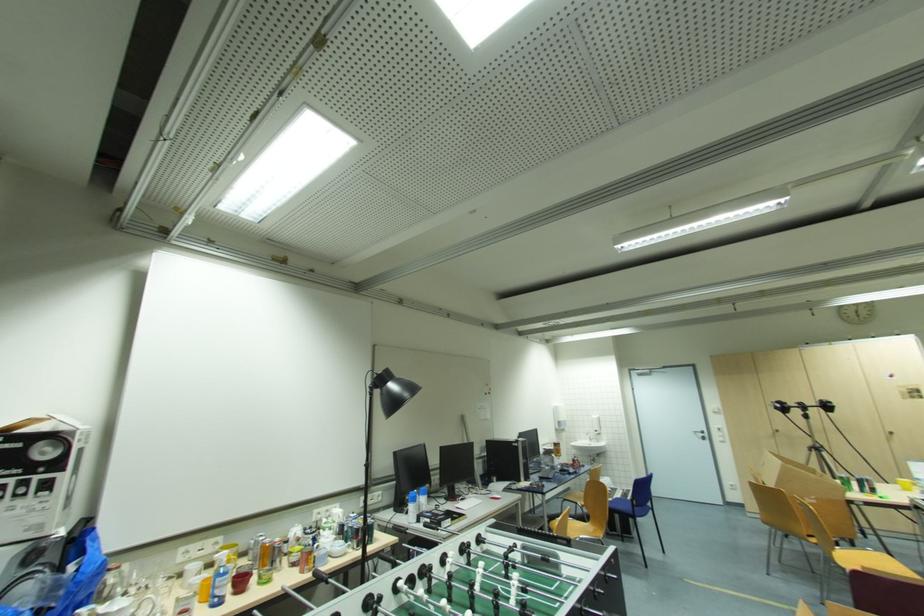
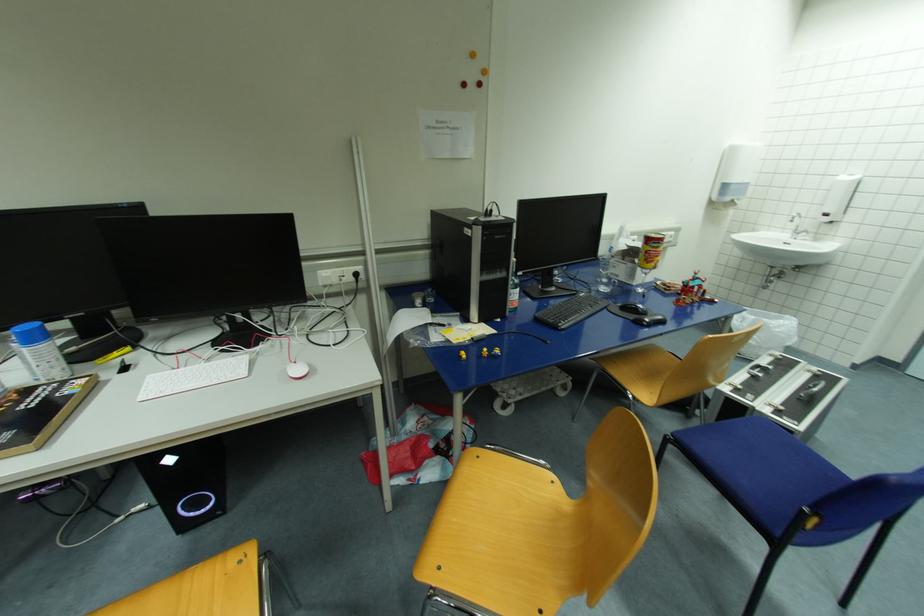
Locate, in the second image, the point that corresponds to point (593, 440) in the first image.

(799, 233)